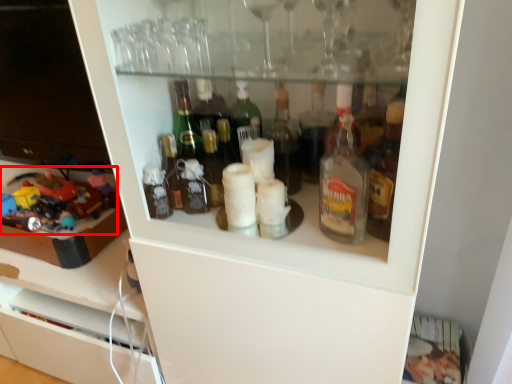
Question: In this image, where is toy (annotated by the red box) located relative to toy?

Choices:
 (A) left
 (B) right

Answer: (A)